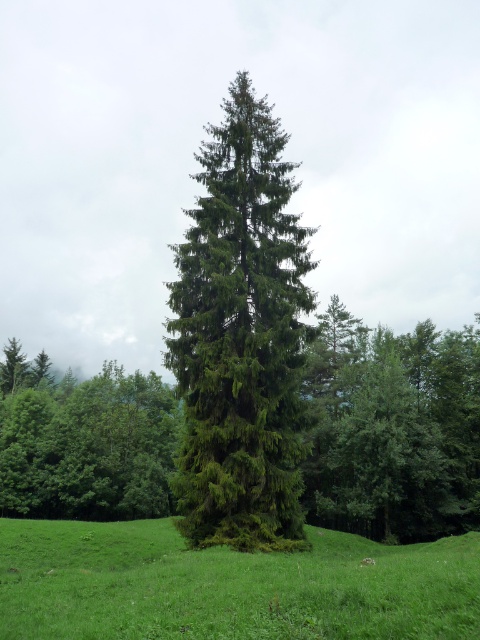
Question: Does green textured tree at center come behind green grassy field at center?

Choices:
 (A) yes
 (B) no

Answer: (A)

Question: Which point appears closest to the camera in this image?

Choices:
 (A) (470, 550)
 (B) (195, 241)

Answer: (B)

Question: Can you confirm if green textured tree at center is smaller than green matte tree at center?

Choices:
 (A) yes
 (B) no

Answer: (A)

Question: Considering the real-world distances, which object is farthest from the green grassy field at center?

Choices:
 (A) green matte tree at center
 (B) green textured tree at center

Answer: (A)

Question: Among these objects, which one is nearest to the camera?

Choices:
 (A) green matte tree at center
 (B) green grassy field at center
 (C) green textured tree at center

Answer: (B)

Question: Can you confirm if green textured tree at center is positioned below green matte tree at center?

Choices:
 (A) yes
 (B) no

Answer: (B)